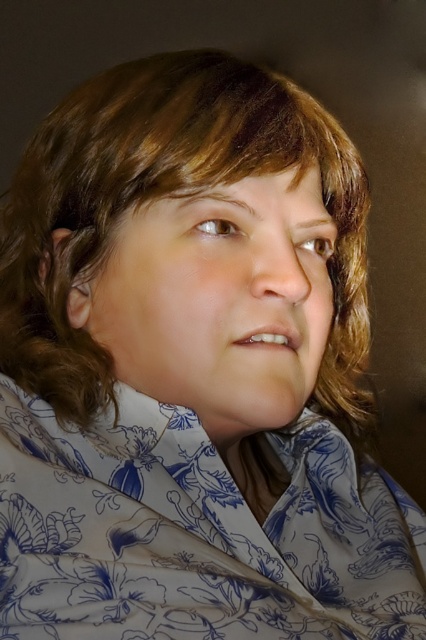
Question: Can you confirm if white floral fabric at center is positioned above smooth skin face at center?

Choices:
 (A) no
 (B) yes

Answer: (A)

Question: Can you confirm if white floral fabric at center is wider than smooth skin face at center?

Choices:
 (A) yes
 (B) no

Answer: (A)

Question: Can you confirm if white floral fabric at center is positioned below smooth skin face at center?

Choices:
 (A) no
 (B) yes

Answer: (B)